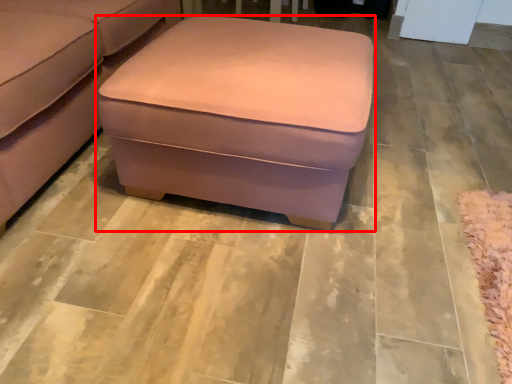
Question: Considering the relative positions of table (annotated by the red box) and studio couch in the image provided, where is table (annotated by the red box) located with respect to the staircase?

Choices:
 (A) right
 (B) left

Answer: (A)